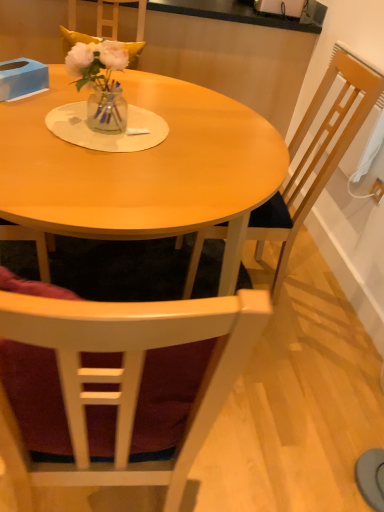
Find the location of `free point above matte wood table at center (from a real-world perspective)`. free point above matte wood table at center (from a real-world perspective) is located at coordinates point(139,132).